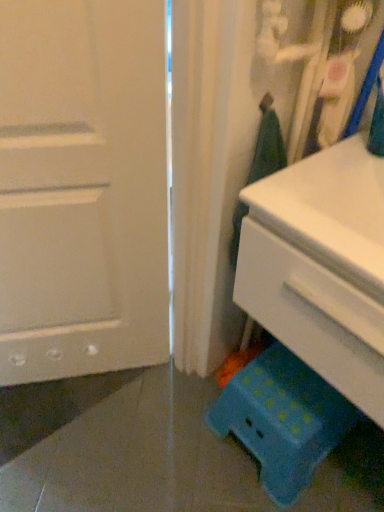
Question: From the image's perspective, is white plastic chest of drawers at lower right located above blue polka dot plastic stool at lower right?

Choices:
 (A) yes
 (B) no

Answer: (A)

Question: Is white plastic chest of drawers at lower right thinner than blue polka dot plastic stool at lower right?

Choices:
 (A) no
 (B) yes

Answer: (A)

Question: Is white plastic chest of drawers at lower right not near blue polka dot plastic stool at lower right?

Choices:
 (A) yes
 (B) no

Answer: (B)

Question: Is white plastic chest of drawers at lower right oriented away from blue polka dot plastic stool at lower right?

Choices:
 (A) no
 (B) yes

Answer: (A)

Question: Does white plastic chest of drawers at lower right touch blue polka dot plastic stool at lower right?

Choices:
 (A) yes
 (B) no

Answer: (B)

Question: Is white plastic chest of drawers at lower right spatially inside teal plastic stool at lower right, or outside of it?

Choices:
 (A) outside
 (B) inside

Answer: (A)

Question: Considering the positions of white plastic chest of drawers at lower right and teal plastic stool at lower right in the image, is white plastic chest of drawers at lower right bigger or smaller than teal plastic stool at lower right?

Choices:
 (A) small
 (B) big

Answer: (B)

Question: Considering their positions, is white plastic chest of drawers at lower right located in front of or behind teal plastic stool at lower right?

Choices:
 (A) behind
 (B) front

Answer: (B)

Question: From a real-world perspective, relative to teal plastic stool at lower right, is white plastic chest of drawers at lower right vertically above or below?

Choices:
 (A) above
 (B) below

Answer: (B)

Question: In terms of height, does white plastic chest of drawers at lower right look taller or shorter compared to blue polka dot plastic stool at lower right?

Choices:
 (A) short
 (B) tall

Answer: (B)

Question: From a real-world perspective, is white plastic chest of drawers at lower right above or below blue polka dot plastic stool at lower right?

Choices:
 (A) below
 (B) above

Answer: (B)

Question: From the image's perspective, is white plastic chest of drawers at lower right located above or below blue polka dot plastic stool at lower right?

Choices:
 (A) above
 (B) below

Answer: (A)

Question: Relative to blue polka dot plastic stool at lower right, is white plastic chest of drawers at lower right in front or behind?

Choices:
 (A) behind
 (B) front

Answer: (B)

Question: From the image's perspective, relative to white matte door at left, is white plastic chest of drawers at lower right above or below?

Choices:
 (A) above
 (B) below

Answer: (B)

Question: In the image, is white plastic chest of drawers at lower right positioned in front of or behind white matte door at left?

Choices:
 (A) front
 (B) behind

Answer: (A)